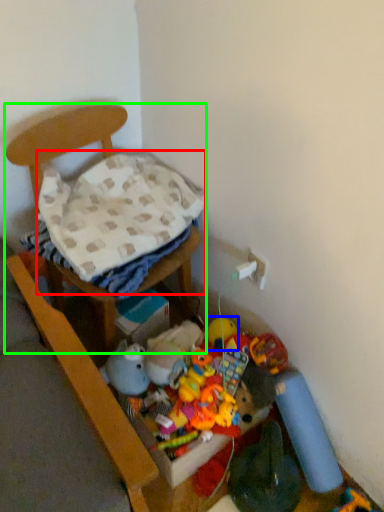
Question: Which object is the farthest from blanket (highlighted by a red box)? Choose among these: toy (highlighted by a blue box) or furniture (highlighted by a green box).

Choices:
 (A) toy
 (B) furniture

Answer: (A)